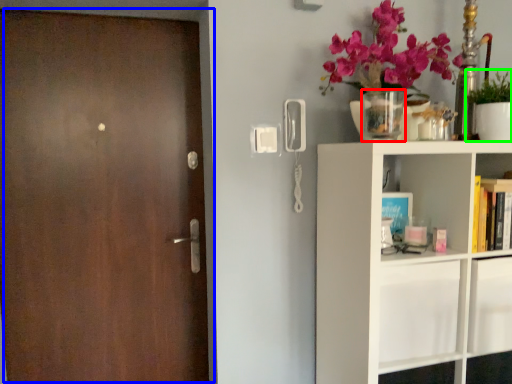
Question: Considering the real-world distances, which object is closest to vase (highlighted by a red box)? door (highlighted by a blue box) or houseplant (highlighted by a green box).

Choices:
 (A) door
 (B) houseplant

Answer: (B)